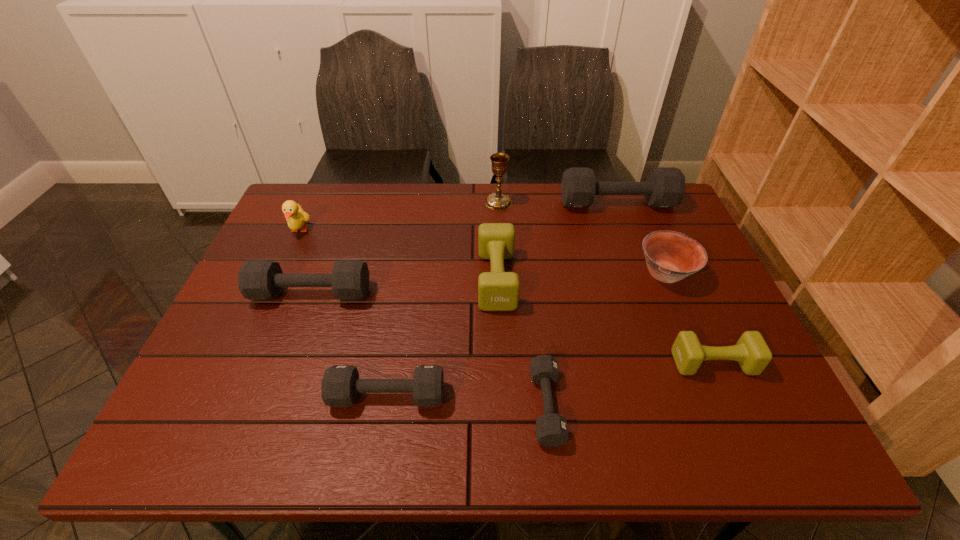
I want to click on free space between the second farthest gray dumbbell and the second smallest gray dumbbell, so click(x=349, y=345).

Find the location of `free space between the nearer olive dumbbell and the bowl`. free space between the nearer olive dumbbell and the bowl is located at coordinates click(x=689, y=318).

Find the location of a particular element. The width and height of the screenshot is (960, 540). vacant area that lies between the second smallest gray dumbbell and the fourth dumbbell from left to right is located at coordinates (467, 401).

At what (x,y) coordinates should I click in order to perform the action: click on blank region between the rightmost gray dumbbell and the shortest object. Please return your answer as a coordinate pair (x, y). The height and width of the screenshot is (540, 960). Looking at the image, I should click on (582, 305).

This screenshot has width=960, height=540. What are the coordinates of `object that stands as the fifth closest to the tallest object` in the screenshot? It's located at (295, 216).

Locate which object ranks fifth in proximity to the tallest object. Please provide its 2D coordinates. Your answer should be formatted as a tuple, i.e. [(x, y)], where the tuple contains the x and y coordinates of a point satisfying the conditions above.

[(295, 216)]

Identify which dumbbell is the fifth nearest to the second farthest gray dumbbell. Please provide its 2D coordinates. Your answer should be formatted as a tuple, i.e. [(x, y)], where the tuple contains the x and y coordinates of a point satisfying the conditions above.

[(751, 351)]

Find the location of a particular element. The image size is (960, 540). dumbbell object that ranks as the fourth closest to the third nearest gray dumbbell is located at coordinates (665, 186).

Find the location of `the second closest gray dumbbell to the bowl`. the second closest gray dumbbell to the bowl is located at coordinates (551, 428).

At what (x,y) coordinates should I click in order to perform the action: click on gray dumbbell that is the closest to the fourth dumbbell from right to left. Please return your answer as a coordinate pair (x, y). The image size is (960, 540). Looking at the image, I should click on (551, 428).